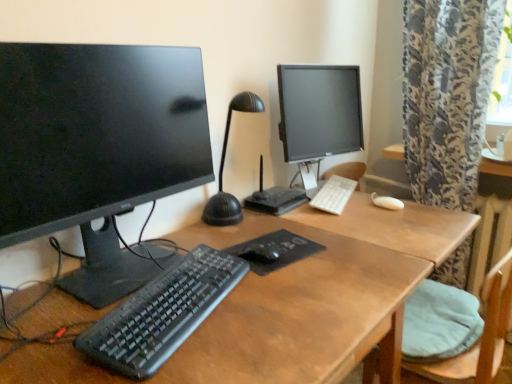
The image size is (512, 384). What are the coordinates of `vacant area that lies between black plastic keyboard at center, which appears as the second computer keyboard when viewed from the right, and black matte mouse at center` in the screenshot? It's located at (225, 302).